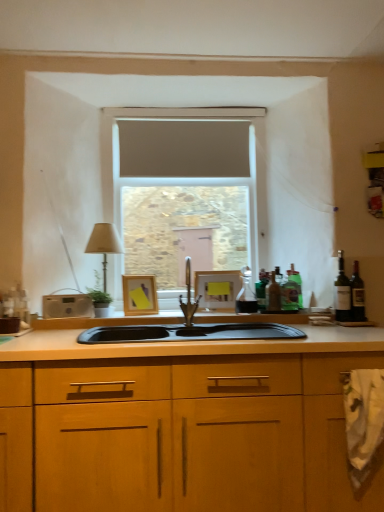
Question: Can you confirm if polished stainless steel faucet at center is smaller than green glass bottle at right, the 1th bottle when ordered from right to left?

Choices:
 (A) yes
 (B) no

Answer: (B)

Question: Is green glass bottle at right, the 1th bottle when ordered from right to left, at the back of polished stainless steel faucet at center?

Choices:
 (A) yes
 (B) no

Answer: (B)

Question: Would you say green glass bottle at right, which ranks as the fourth bottle in left-to-right order, is part of polished stainless steel faucet at center's contents?

Choices:
 (A) yes
 (B) no

Answer: (B)

Question: From the image's perspective, is polished stainless steel faucet at center beneath green glass bottle at right, the 1th bottle when ordered from right to left?

Choices:
 (A) yes
 (B) no

Answer: (B)

Question: From the image's perspective, does polished stainless steel faucet at center appear higher than green glass bottle at right, which ranks as the fourth bottle in left-to-right order?

Choices:
 (A) no
 (B) yes

Answer: (B)

Question: Would you say polished stainless steel faucet at center is a long distance from green glass bottle at right, which ranks as the fourth bottle in left-to-right order?

Choices:
 (A) no
 (B) yes

Answer: (A)

Question: Considering the relative sizes of green glass bottle at right, acting as the third bottle starting from the left, and polished stainless steel faucet at center in the image provided, is green glass bottle at right, acting as the third bottle starting from the left, taller than polished stainless steel faucet at center?

Choices:
 (A) no
 (B) yes

Answer: (A)

Question: From a real-world perspective, is green glass bottle at right, acting as the second bottle starting from the right, on polished stainless steel faucet at center?

Choices:
 (A) yes
 (B) no

Answer: (B)

Question: From the image's perspective, is green glass bottle at right, acting as the third bottle starting from the left, under polished stainless steel faucet at center?

Choices:
 (A) yes
 (B) no

Answer: (A)

Question: Is green glass bottle at right, acting as the third bottle starting from the left, wider than polished stainless steel faucet at center?

Choices:
 (A) no
 (B) yes

Answer: (A)

Question: Are green glass bottle at right, acting as the third bottle starting from the left, and polished stainless steel faucet at center located far from each other?

Choices:
 (A) yes
 (B) no

Answer: (B)

Question: Is green glass bottle at right, acting as the second bottle starting from the right, to the left of polished stainless steel faucet at center from the viewer's perspective?

Choices:
 (A) no
 (B) yes

Answer: (A)

Question: Is beige fabric lampshade at left wider than green glass bottle at right, which ranks as the fourth bottle in left-to-right order?

Choices:
 (A) no
 (B) yes

Answer: (B)